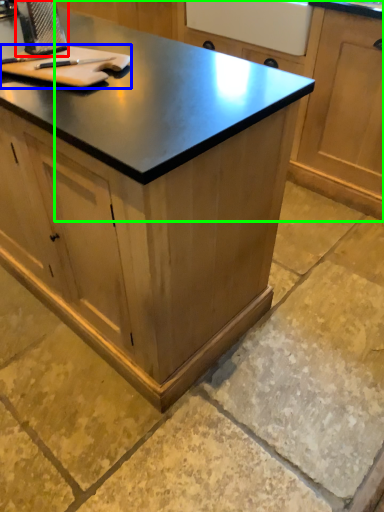
Question: Estimate the real-world distances between objects in this image. Which object is farther from appliance (highlighted by a red box), cutting board (highlighted by a blue box) or cabinetry (highlighted by a green box)?

Choices:
 (A) cutting board
 (B) cabinetry

Answer: (B)